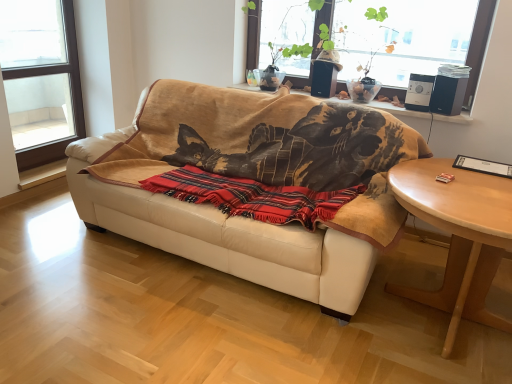
Question: Is beige leather couch at center located within transparent glass window at upper center, which is the 2th window from left to right?

Choices:
 (A) yes
 (B) no

Answer: (B)

Question: Is transparent glass window at upper center, acting as the first window starting from the right, turned away from beige leather couch at center?

Choices:
 (A) no
 (B) yes

Answer: (A)

Question: Is transparent glass window at upper center, which is the 2th window from left to right, oriented towards beige leather couch at center?

Choices:
 (A) no
 (B) yes

Answer: (A)

Question: Can you confirm if transparent glass window at upper center, which is the 2th window from left to right, is taller than beige leather couch at center?

Choices:
 (A) yes
 (B) no

Answer: (B)

Question: From the image's perspective, does transparent glass window at upper center, acting as the first window starting from the right, appear higher than beige leather couch at center?

Choices:
 (A) no
 (B) yes

Answer: (B)

Question: Is point (411, 200) positioned closer to the camera than point (243, 87)?

Choices:
 (A) closer
 (B) farther

Answer: (A)

Question: Considering the positions of light brown wooden coffee table at lower right and wooden window sill at upper center in the image, is light brown wooden coffee table at lower right wider or thinner than wooden window sill at upper center?

Choices:
 (A) wide
 (B) thin

Answer: (A)

Question: Would you say light brown wooden coffee table at lower right is inside or outside wooden window sill at upper center?

Choices:
 (A) outside
 (B) inside

Answer: (A)

Question: Is light brown wooden coffee table at lower right bigger or smaller than wooden window sill at upper center?

Choices:
 (A) big
 (B) small

Answer: (A)

Question: Relative to light brown wooden coffee table at lower right, is wooden window sill at upper center in front or behind?

Choices:
 (A) behind
 (B) front

Answer: (A)

Question: Based on their sizes in the image, would you say wooden window sill at upper center is bigger or smaller than light brown wooden coffee table at lower right?

Choices:
 (A) small
 (B) big

Answer: (A)

Question: Is wooden window sill at upper center inside the boundaries of light brown wooden coffee table at lower right, or outside?

Choices:
 (A) outside
 (B) inside

Answer: (A)

Question: Is wooden window sill at upper center taller or shorter than light brown wooden coffee table at lower right?

Choices:
 (A) short
 (B) tall

Answer: (A)

Question: From the image's perspective, is transparent glass window at upper center, which is the 2th window from left to right, located above or below beige leather couch at center?

Choices:
 (A) below
 (B) above

Answer: (B)

Question: Considering the positions of point (258, 21) and point (198, 248), is point (258, 21) closer or farther from the camera than point (198, 248)?

Choices:
 (A) closer
 (B) farther

Answer: (B)